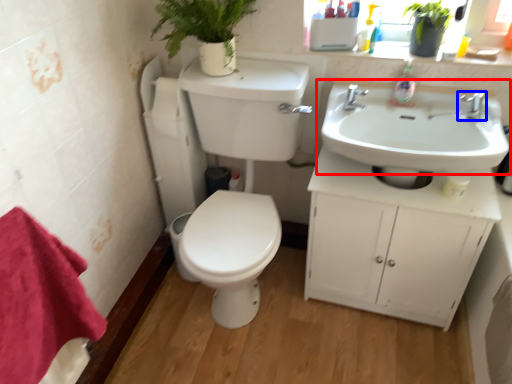
Question: Among these objects, which one is nearest to the camera, sink (highlighted by a red box) or tap (highlighted by a blue box)?

Choices:
 (A) sink
 (B) tap

Answer: (A)